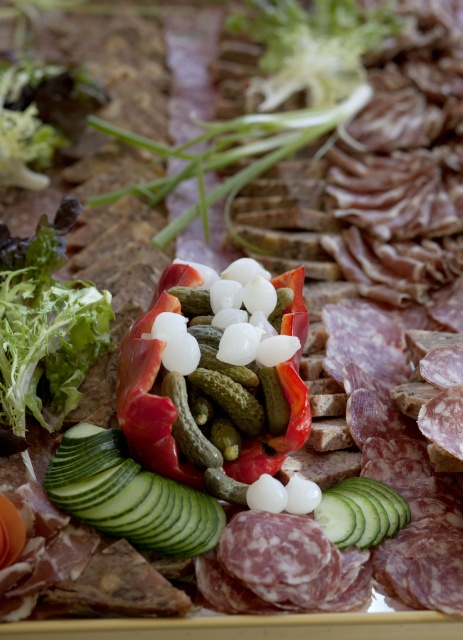
Question: Estimate the real-world distances between objects in this image. Which object is closer to the green crisp cucumber at center?

Choices:
 (A) green/crisp cucumber at center
 (B) green pickled at center

Answer: (A)

Question: Which object is closer to the camera taking this photo?

Choices:
 (A) green crisp cucumber at center
 (B) green/crisp cucumber at center

Answer: (B)

Question: In this image, where is green/crisp cucumber at center located relative to green crisp cucumber at center?

Choices:
 (A) above
 (B) below

Answer: (A)

Question: Among these points, which one is farthest from the camera?

Choices:
 (A) [192, 467]
 (B) [363, 513]
 (C) [211, 545]

Answer: (B)

Question: Can you confirm if green/crisp cucumber at center is positioned to the left of green crisp cucumber at center?

Choices:
 (A) yes
 (B) no

Answer: (A)

Question: Is green pickled at center above green crisp cucumber at center?

Choices:
 (A) no
 (B) yes

Answer: (B)